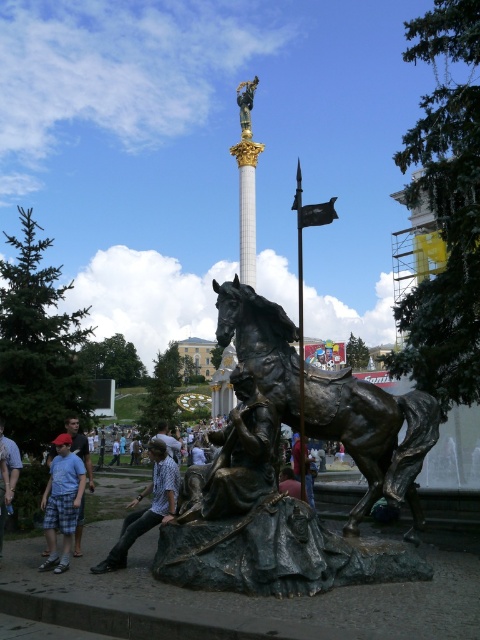
You are standing at the camera position and want to take a photo of the bronze statue of a seated figure holding a sword and the plaid shirt at lower center. Can you fit both subjects into your camera frame if the maximum distance your camera can focus is 100 feet?

The plaid shirt at lower center is 100.19 feet away from the camera, which exceeds the camera focus limit of 100 feet. Therefore, you cannot capture both subjects in focus simultaneously.

You are a photographer standing in the public square and want to capture both the blue plaid shorts at lower left and the plaid shirt at lower center in a single frame. Which clothing item should you focus on first to ensure both are in the frame?

The blue plaid shorts at lower left is smaller in size compared to the plaid shirt at lower center. To ensure both are in the frame, focus on the plaid shirt at lower center first since it is larger and will be easier to center while adjusting the camera angle to include the smaller shorts.